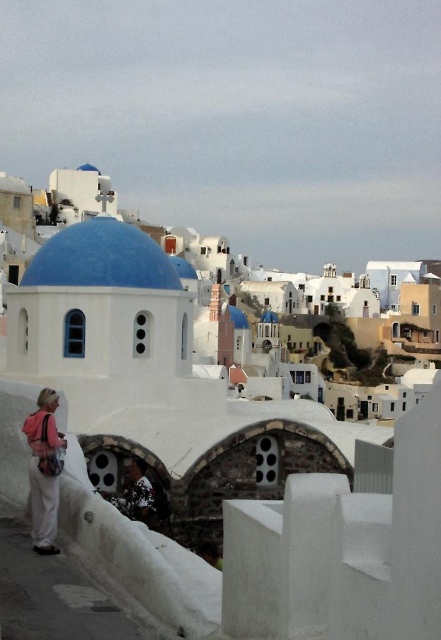
Question: Which of these objects is positioned closest to the camouflage shirt at center?

Choices:
 (A) pink fabric at lower left
 (B) blue glossy dome at center

Answer: (A)

Question: Which object is farther from the camera taking this photo?

Choices:
 (A) blue glossy dome at center
 (B) camouflage shirt at center
 (C) pink fabric at lower left

Answer: (A)

Question: Based on their relative distances, which object is nearer to the blue glossy dome at center?

Choices:
 (A) pink fabric at lower left
 (B) camouflage shirt at center

Answer: (B)

Question: Can you confirm if blue glossy dome at center is smaller than pink fabric at lower left?

Choices:
 (A) yes
 (B) no

Answer: (B)

Question: Can you confirm if pink fabric at lower left is positioned below camouflage shirt at center?

Choices:
 (A) no
 (B) yes

Answer: (B)

Question: Can you confirm if blue glossy dome at center is positioned below pink fabric at lower left?

Choices:
 (A) no
 (B) yes

Answer: (A)